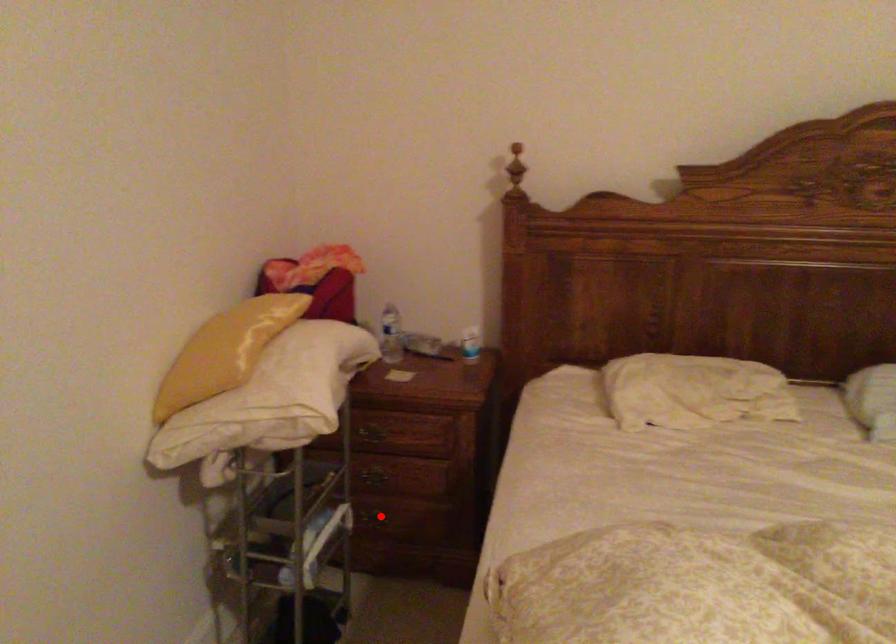
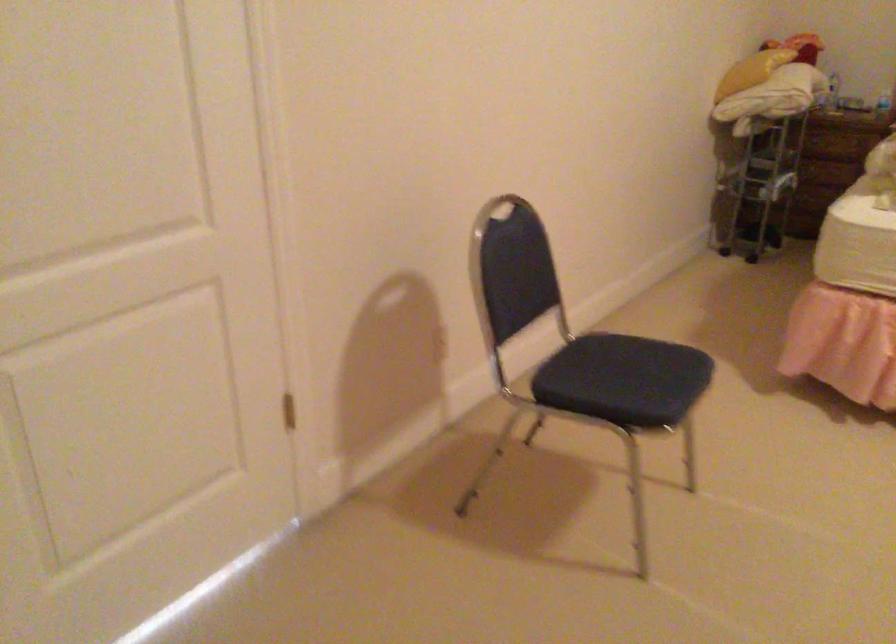
Question: I am providing you with two images of the same scene from different viewpoints. A red point is marked on the first image. Can you still see the location of the red point in image 2?

Choices:
 (A) Yes
 (B) No

Answer: (B)